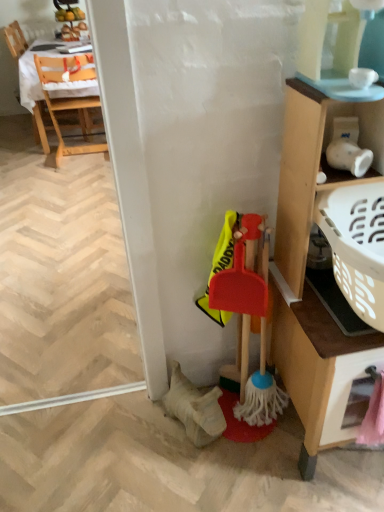
Question: Does pink plastic drawer at lower right have a greater height compared to transparent plastic screen door at lower right?

Choices:
 (A) yes
 (B) no

Answer: (A)

Question: Would you consider pink plastic drawer at lower right to be distant from transparent plastic screen door at lower right?

Choices:
 (A) yes
 (B) no

Answer: (A)

Question: From the image's perspective, is pink plastic drawer at lower right above transparent plastic screen door at lower right?

Choices:
 (A) yes
 (B) no

Answer: (B)

Question: Is pink plastic drawer at lower right placed right next to transparent plastic screen door at lower right?

Choices:
 (A) yes
 (B) no

Answer: (B)

Question: Is pink plastic drawer at lower right located outside transparent plastic screen door at lower right?

Choices:
 (A) yes
 (B) no

Answer: (A)

Question: From the image's perspective, is pink plastic drawer at lower right located beneath transparent plastic screen door at lower right?

Choices:
 (A) yes
 (B) no

Answer: (A)

Question: Is there a large distance between rubberized plastic broom at lower right and wooden cabinet at right?

Choices:
 (A) yes
 (B) no

Answer: (B)

Question: Does rubberized plastic broom at lower right have a lesser width compared to wooden cabinet at right?

Choices:
 (A) yes
 (B) no

Answer: (A)

Question: Does rubberized plastic broom at lower right contain wooden cabinet at right?

Choices:
 (A) yes
 (B) no

Answer: (B)

Question: From the image's perspective, is rubberized plastic broom at lower right over wooden cabinet at right?

Choices:
 (A) no
 (B) yes

Answer: (A)

Question: Is rubberized plastic broom at lower right at the left side of wooden cabinet at right?

Choices:
 (A) yes
 (B) no

Answer: (A)

Question: Is rubberized plastic broom at lower right at the right side of wooden cabinet at right?

Choices:
 (A) no
 (B) yes

Answer: (A)

Question: From a real-world perspective, does wooden chair at upper left, the 2th chair viewed from the right, sit lower than rubberized plastic broom at lower right?

Choices:
 (A) no
 (B) yes

Answer: (A)